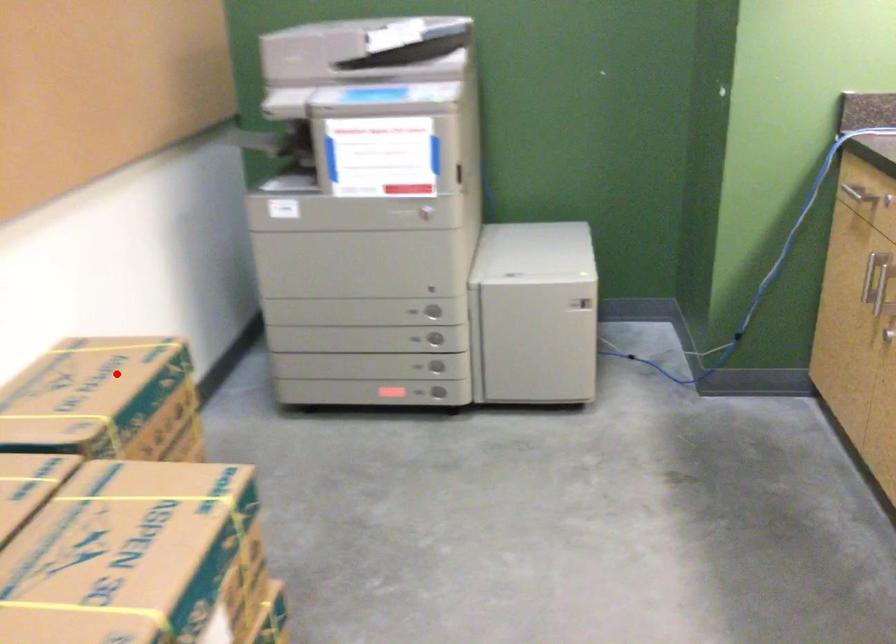
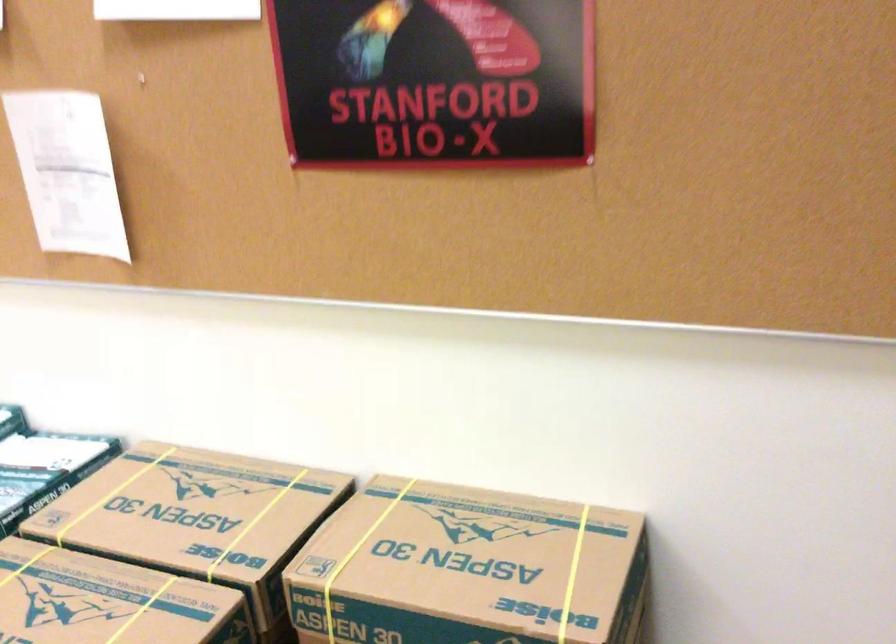
Question: I am providing you with two images of the same scene from different viewpoints. A red point is marked on the first image. At the location where the point appears in image 1, is it still visible in image 2?

Choices:
 (A) Yes
 (B) No

Answer: (A)